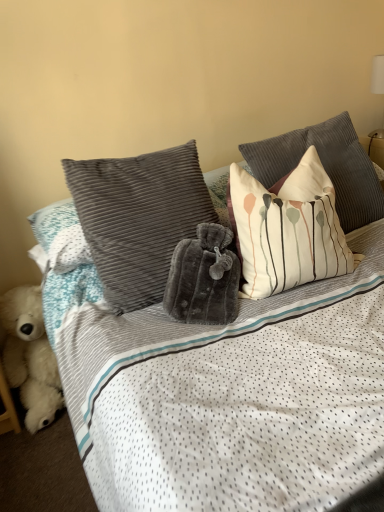
Question: Is velvety gray pillow at center, placed as the 3th pillow when sorted from right to left, inside or outside of white cotton pillow with abstract design at upper right, which is the 1th pillow from right to left?

Choices:
 (A) outside
 (B) inside

Answer: (A)

Question: In the image, is velvety gray pillow at center, which appears as the first pillow when viewed from the left, positioned in front of or behind white cotton pillow with abstract design at upper right, positioned as the third pillow in left-to-right order?

Choices:
 (A) behind
 (B) front

Answer: (B)

Question: Estimate the real-world distances between objects in this image. Which object is farther from the white cotton pillow with abstract design at upper right, positioned as the third pillow in left-to-right order?

Choices:
 (A) velvety gray pillow at center, which appears as the first pillow when viewed from the left
 (B) white striped pillow at upper right, which is counted as the 2th pillow, starting from the right
 (C) white fluffy teddy bear at lower left

Answer: (C)

Question: Which object is positioned farthest from the white fluffy teddy bear at lower left?

Choices:
 (A) white striped pillow at upper right, marked as the 2th pillow in a left-to-right arrangement
 (B) white cotton pillow with abstract design at upper right, positioned as the third pillow in left-to-right order
 (C) velvety gray pillow at center, placed as the 3th pillow when sorted from right to left

Answer: (B)